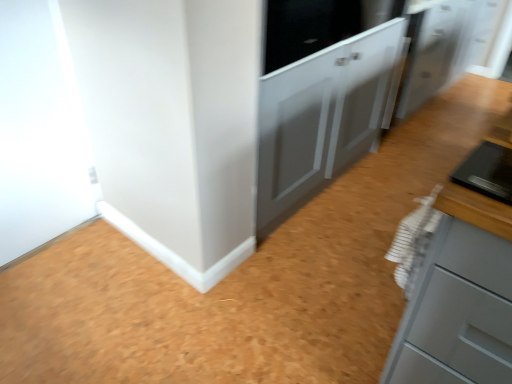
The height and width of the screenshot is (384, 512). What are the coordinates of `free space in front of matte gray cabinet at center` in the screenshot? It's located at (273, 285).